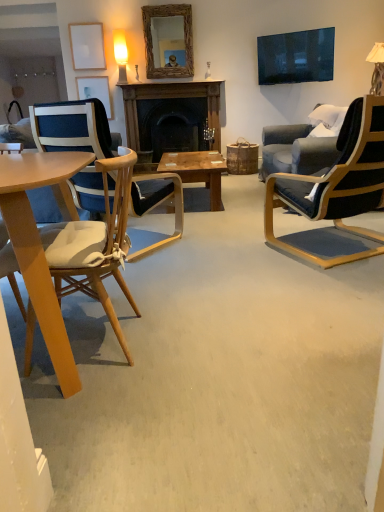
I want to click on free space to the back side of light brown wood chair at left, which appears as the 2th chair when viewed from the left, so click(139, 293).